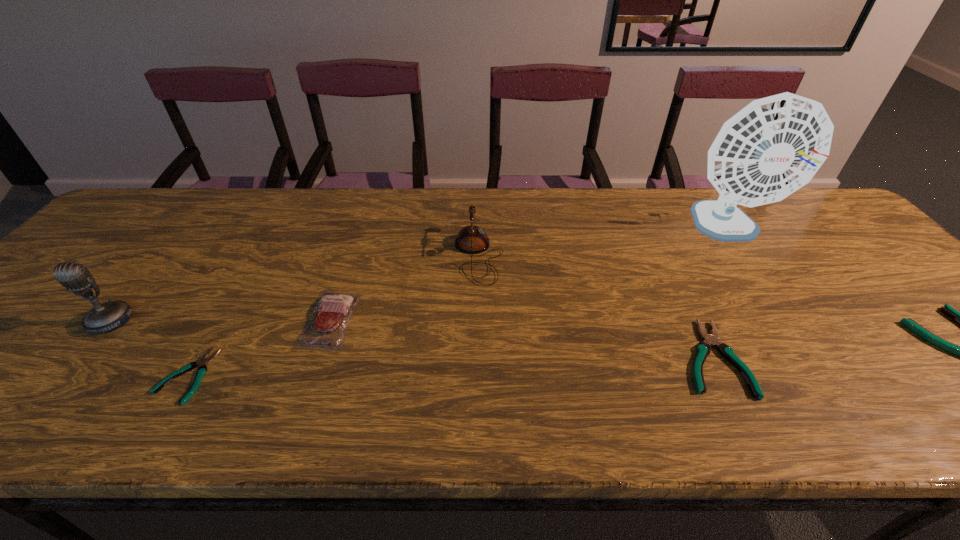
Identify the location of the shortest object. (203, 361).

Find the location of a particular element. This screenshot has height=540, width=960. the shortest pliers is located at coordinates (203, 361).

Find the location of a particular element. This screenshot has width=960, height=540. the second tallest pliers is located at coordinates (703, 348).

The image size is (960, 540). Identify the location of the second shortest object. (703, 348).

Find the location of a particular element. This screenshot has width=960, height=540. fan is located at coordinates (771, 148).

Locate an element on the screen. Image resolution: width=960 pixels, height=540 pixels. the tallest object is located at coordinates (771, 148).

Image resolution: width=960 pixels, height=540 pixels. What are the coordinates of `the leftmost object` in the screenshot? It's located at (108, 316).

Image resolution: width=960 pixels, height=540 pixels. Identify the location of microphone. (108, 316).

You are a GUI agent. You are given a task and a screenshot of the screen. Output one action in this format:
    pyautogui.click(x=<x>, y=<y>)
    Task: Click on the fourth object from right to left
    
    Given the screenshot: What is the action you would take?
    pyautogui.click(x=471, y=239)

The width and height of the screenshot is (960, 540). Identify the location of telephone. (471, 239).